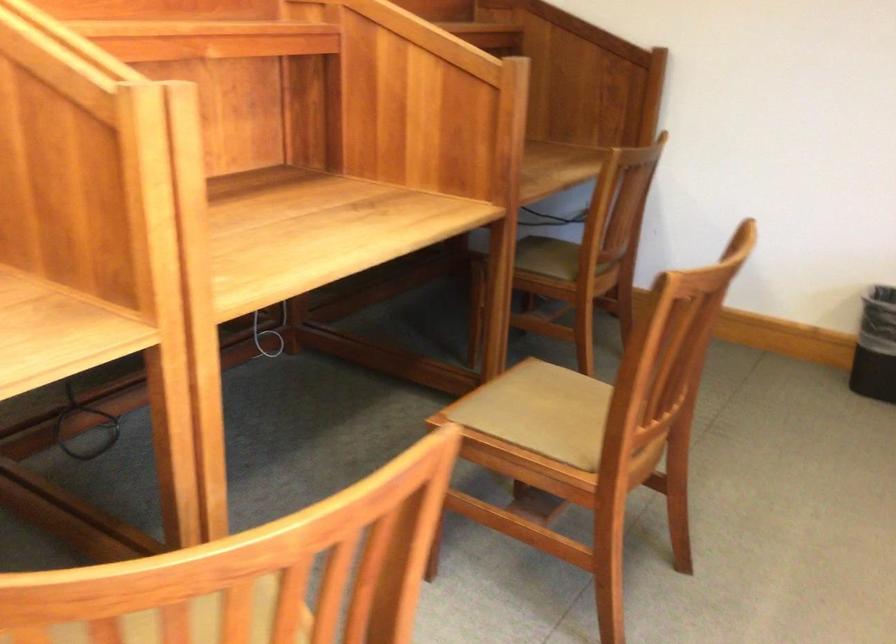
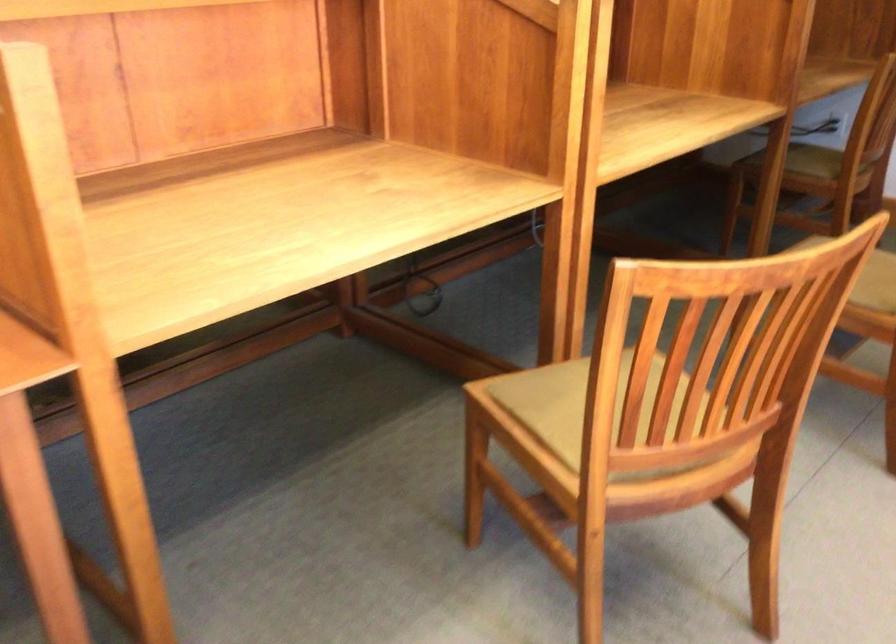
Question: How did the camera likely rotate?

Choices:
 (A) Left
 (B) Right
 (C) Up
 (D) Down

Answer: (A)